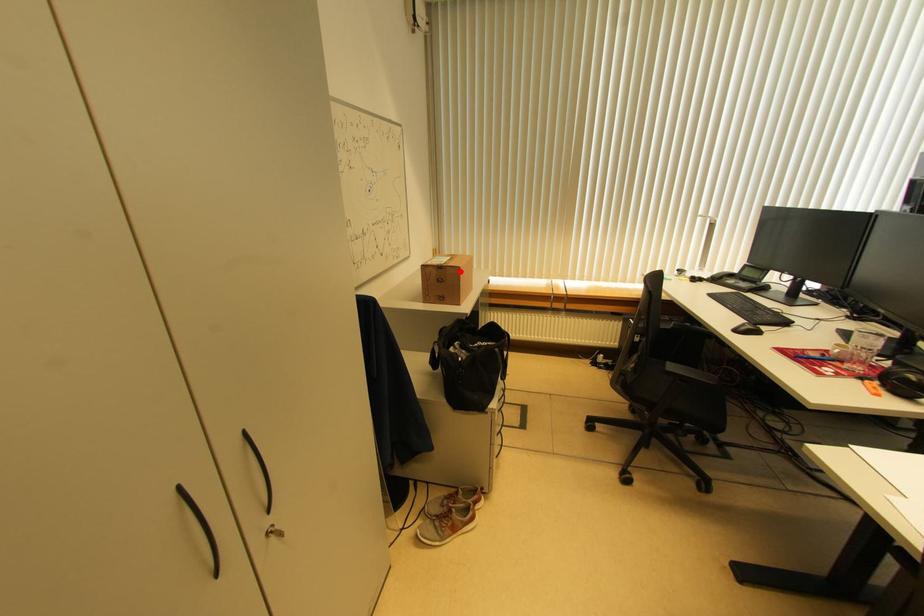
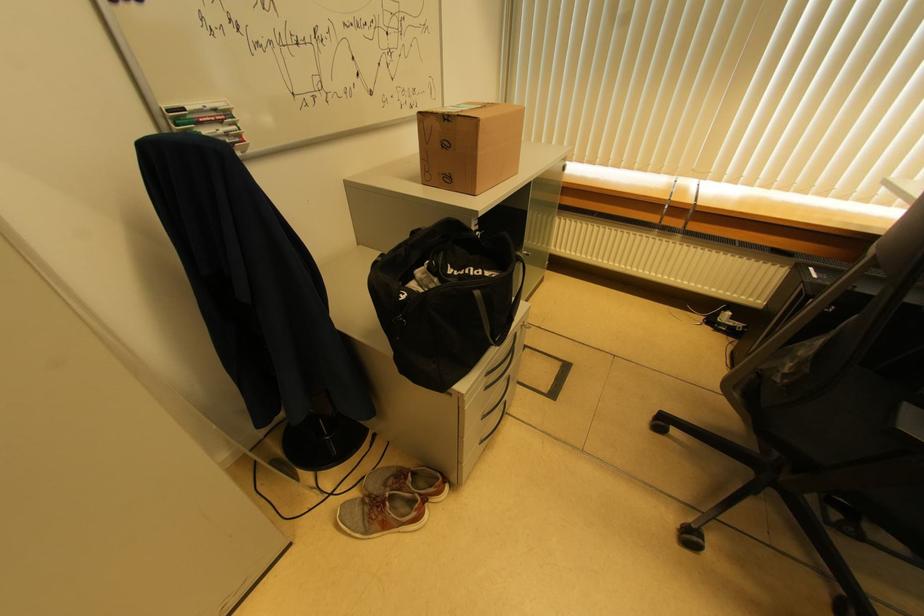
Where in the second image is the point corresponding to the highlighted location from the first image?

(477, 124)